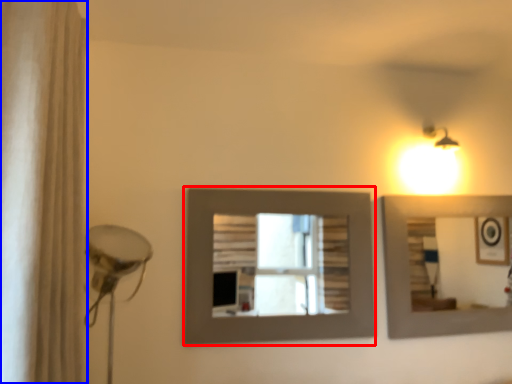
Question: Among these objects, which one is farthest to the camera, picture frame (highlighted by a red box) or shower curtain (highlighted by a blue box)?

Choices:
 (A) picture frame
 (B) shower curtain

Answer: (A)